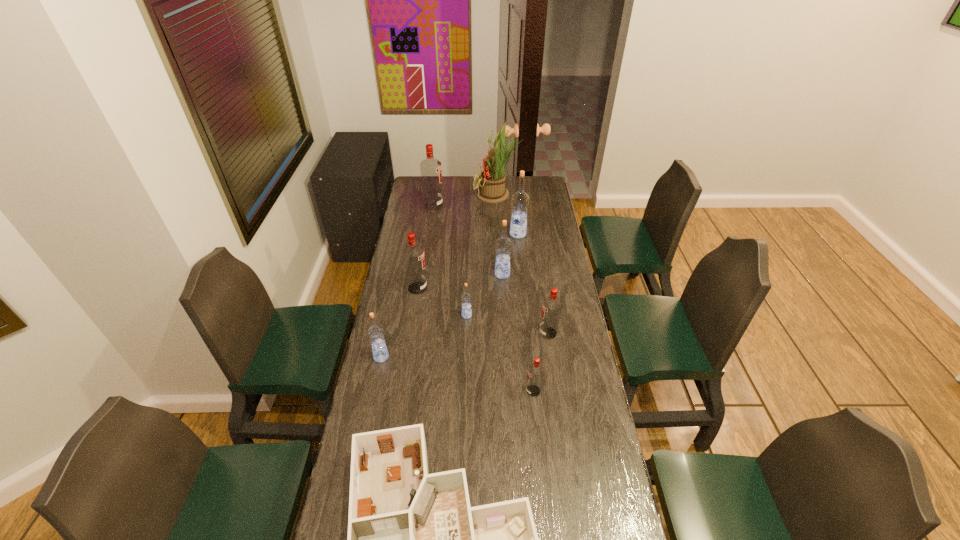
Locate an element on the screen. The width and height of the screenshot is (960, 540). the tallest object is located at coordinates (492, 189).

At what (x,y) coordinates should I click in order to perform the action: click on the farthest red vodka. Please return your answer as a coordinate pair (x, y). The height and width of the screenshot is (540, 960). Looking at the image, I should click on (431, 173).

You are a GUI agent. You are given a task and a screenshot of the screen. Output one action in this format:
    pyautogui.click(x=<x>, y=<y>)
    Task: Click on the farthest vodka
    
    Given the screenshot: What is the action you would take?
    pyautogui.click(x=431, y=173)

I want to click on the biggest blue vodka, so click(520, 199).

The height and width of the screenshot is (540, 960). In order to click on the rightmost blue vodka in this screenshot , I will do `click(520, 199)`.

Identify the location of the seventh nearest object. Image resolution: width=960 pixels, height=540 pixels. (503, 245).

The height and width of the screenshot is (540, 960). Find the location of `the fourth vodka from right to left`. the fourth vodka from right to left is located at coordinates (503, 245).

At what (x,y) coordinates should I click in order to perform the action: click on the second farthest red vodka. Please return your answer as a coordinate pair (x, y). This screenshot has width=960, height=540. Looking at the image, I should click on (413, 255).

Locate an element on the screen. The width and height of the screenshot is (960, 540). the third smallest red vodka is located at coordinates (413, 255).

Find the location of a particular element. The image size is (960, 540). the leftmost vodka is located at coordinates (375, 333).